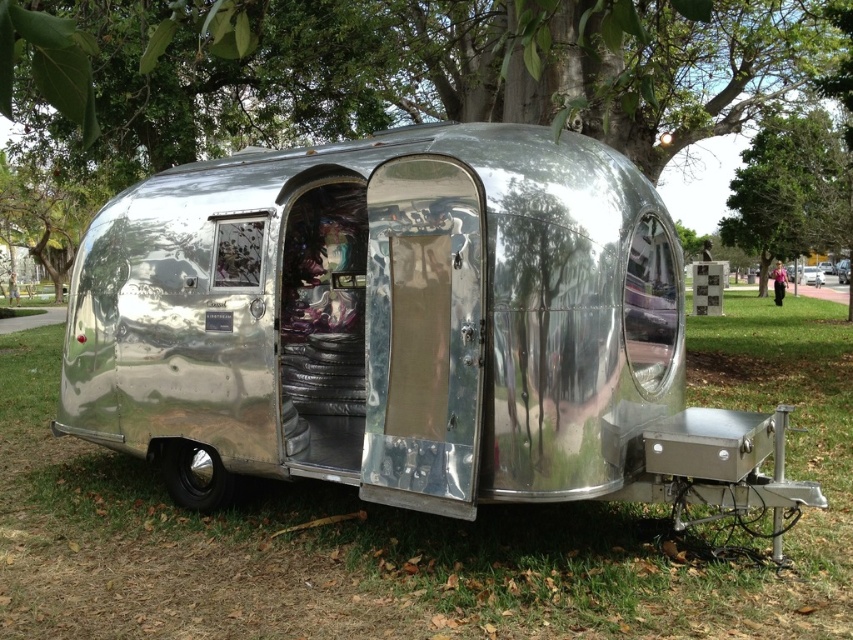
Which is more to the right, glossy bark tree at upper center or shiny metallic trailer at center?

shiny metallic trailer at center

Can you confirm if glossy bark tree at upper center is thinner than shiny metallic trailer at center?

Incorrect, glossy bark tree at upper center's width is not less than shiny metallic trailer at center's.

The height and width of the screenshot is (640, 853). Describe the element at coordinates (448, 67) in the screenshot. I see `glossy bark tree at upper center` at that location.

I want to click on glossy bark tree at upper center, so click(448, 67).

Measure the distance between green grass at lower center and green leafy tree at upper center.

The distance of green grass at lower center from green leafy tree at upper center is 11.04 meters.

Is green grass at lower center shorter than green leafy tree at upper center?

Indeed, green grass at lower center has a lesser height compared to green leafy tree at upper center.

Does point (294, 612) come behind point (851, 161)?

No, it is not.

In order to click on green grass at lower center in this screenshot , I will do `click(426, 529)`.

Is glossy bark tree at upper center thinner than green leafy tree at upper center?

In fact, glossy bark tree at upper center might be wider than green leafy tree at upper center.

Between glossy bark tree at upper center and green leafy tree at upper center, which one has less height?

green leafy tree at upper center is shorter.

Where is `glossy bark tree at upper center`? This screenshot has height=640, width=853. glossy bark tree at upper center is located at coordinates (448, 67).

Where is `glossy bark tree at upper center`? The image size is (853, 640). glossy bark tree at upper center is located at coordinates (448, 67).